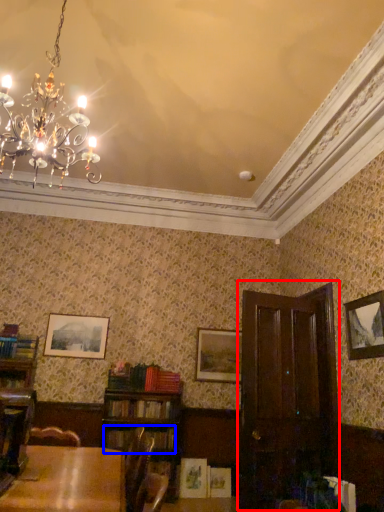
Question: Among these objects, which one is farthest to the camera, armoire (highlighted by a red box) or book (highlighted by a blue box)?

Choices:
 (A) armoire
 (B) book

Answer: (B)